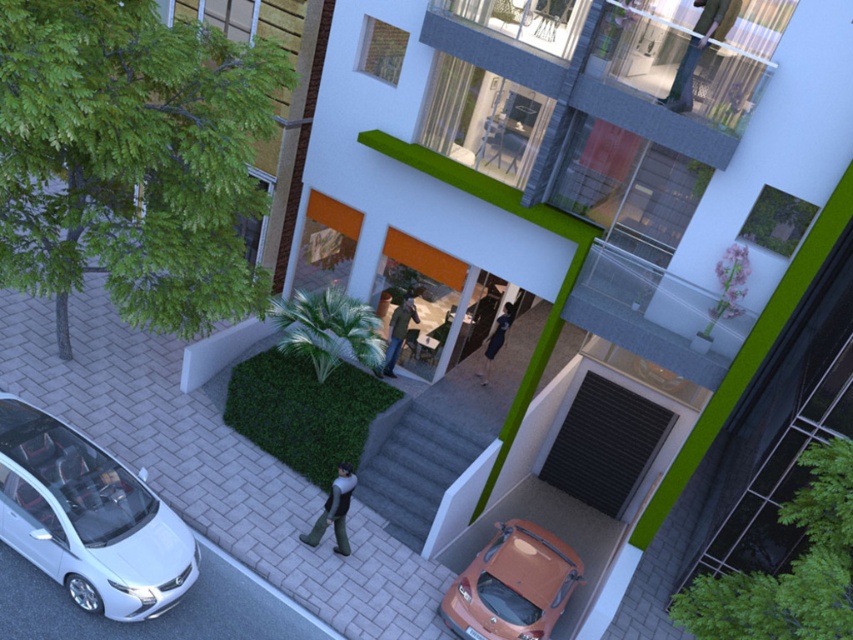
You are a delivery person standing at the entrance of the building holding a package. You see the green fabric jacket at upper center and the dark blue dress at center. How far apart are these two items from each other?

The distance between the green fabric jacket at upper center and the dark blue dress at center is 6.31 meters.

You are a delivery person trying to place two jackets on a shelf. The shelf has a width of 1.2 meters. The green fabric jacket at upper center and the dark green textured jacket at center need to be placed side by side. Can both jackets fit on the shelf without overlapping?

The green fabric jacket at upper center might be wider than the dark green textured jacket at center. If the total width of both jackets is less than or equal to 1.2 meters, they can fit. However, since the exact widths are not provided, it is uncertain whether they will fit without overlapping.

You are standing in front of the modern building and see two points marked on the ground. The first point is at coordinate point (712, 1) and the second is at point (496, 320). Which point is closer to the entrance of the building?

Point (712, 1) is in front of point (496, 320), so it is closer to the entrance of the building.